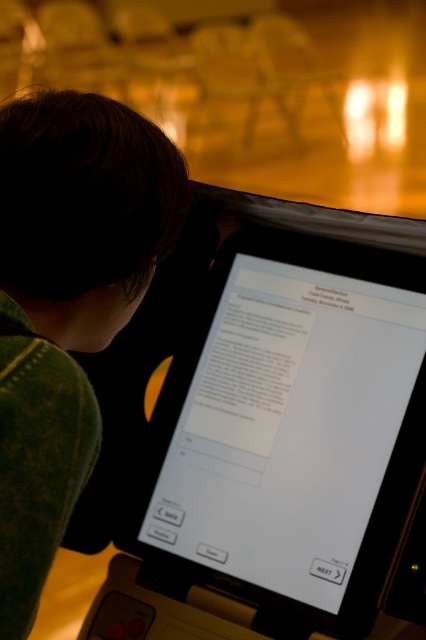
Question: Does white glossy screen at center have a greater width compared to green textured sweater at upper left?

Choices:
 (A) no
 (B) yes

Answer: (B)

Question: Can you confirm if white glossy screen at center is positioned to the right of green textured sweater at upper left?

Choices:
 (A) yes
 (B) no

Answer: (A)

Question: Does white glossy screen at center appear over green textured sweater at upper left?

Choices:
 (A) yes
 (B) no

Answer: (B)

Question: Which point appears farthest from the camera in this image?

Choices:
 (A) (209, 586)
 (B) (71, 150)

Answer: (A)

Question: Among these objects, which one is nearest to the camera?

Choices:
 (A) green textured sweater at upper left
 (B) white glossy screen at center

Answer: (A)

Question: Among these objects, which one is farthest from the camera?

Choices:
 (A) white glossy screen at center
 (B) green textured sweater at upper left

Answer: (A)